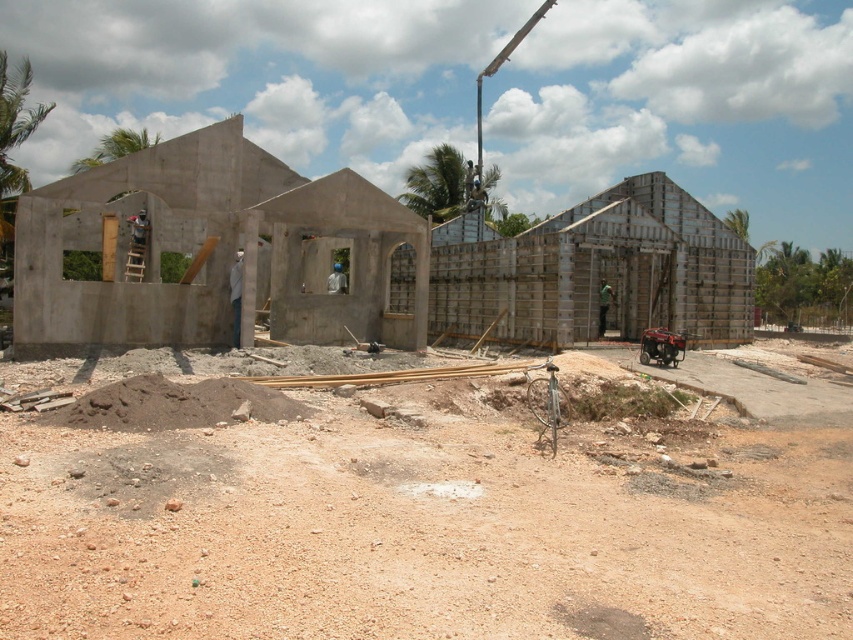
Question: Can you confirm if brown gravel at lower center is positioned to the right of green fabric construction worker at center?

Choices:
 (A) yes
 (B) no

Answer: (B)

Question: Can you confirm if brown gravel at lower center is wider than smooth concrete building at center?

Choices:
 (A) no
 (B) yes

Answer: (A)

Question: Considering the real-world distances, which object is farthest from the brown gravel at lower center?

Choices:
 (A) green fabric construction worker at center
 (B) smooth concrete building at center

Answer: (A)

Question: Is smooth concrete building at center thinner than green fabric construction worker at center?

Choices:
 (A) no
 (B) yes

Answer: (A)

Question: Which point is closer to the camera taking this photo?

Choices:
 (A) (643, 225)
 (B) (601, 284)

Answer: (A)

Question: Which point is farther to the camera?

Choices:
 (A) (209, 166)
 (B) (44, 636)

Answer: (A)